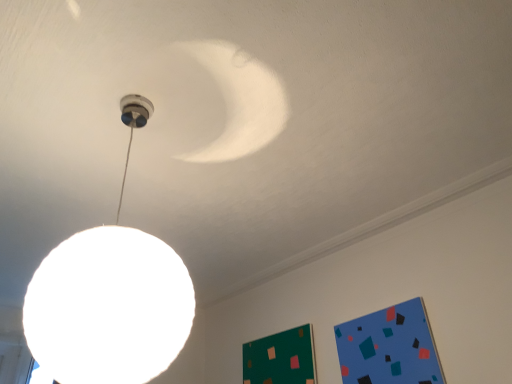
Question: From the image's perspective, would you say green matte bulletin board at lower right, positioned as the 1th bulletin board in left-to-right order, is shown under white matte globe lamp at upper center?

Choices:
 (A) yes
 (B) no

Answer: (A)

Question: Could you tell me if green matte bulletin board at lower right, the 2th bulletin board from the front, is facing white matte globe lamp at upper center?

Choices:
 (A) no
 (B) yes

Answer: (B)

Question: Considering the relative sizes of green matte bulletin board at lower right, positioned as the 1th bulletin board in left-to-right order, and white matte globe lamp at upper center in the image provided, is green matte bulletin board at lower right, positioned as the 1th bulletin board in left-to-right order, shorter than white matte globe lamp at upper center?

Choices:
 (A) yes
 (B) no

Answer: (A)

Question: Is green matte bulletin board at lower right, placed as the second bulletin board when sorted from right to left, further to the viewer compared to white matte globe lamp at upper center?

Choices:
 (A) no
 (B) yes

Answer: (B)

Question: Is the depth of green matte bulletin board at lower right, placed as the second bulletin board when sorted from right to left, less than that of white matte globe lamp at upper center?

Choices:
 (A) no
 (B) yes

Answer: (A)

Question: Can you confirm if green matte bulletin board at lower right, the 2th bulletin board from the front, is bigger than white matte globe lamp at upper center?

Choices:
 (A) no
 (B) yes

Answer: (A)

Question: Does blue matte bulletin board at lower right, placed as the first bulletin board when sorted from front to back, appear on the left side of green matte bulletin board at lower right, the 2th bulletin board from the front?

Choices:
 (A) no
 (B) yes

Answer: (A)

Question: Considering the relative sizes of blue matte bulletin board at lower right, placed as the first bulletin board when sorted from front to back, and green matte bulletin board at lower right, the 2th bulletin board from the front, in the image provided, is blue matte bulletin board at lower right, placed as the first bulletin board when sorted from front to back, shorter than green matte bulletin board at lower right, the 2th bulletin board from the front,?

Choices:
 (A) no
 (B) yes

Answer: (A)

Question: Considering the relative sizes of blue matte bulletin board at lower right, which is the 2th bulletin board from left to right, and green matte bulletin board at lower right, the 2th bulletin board from the front, in the image provided, is blue matte bulletin board at lower right, which is the 2th bulletin board from left to right, smaller than green matte bulletin board at lower right, the 2th bulletin board from the front,?

Choices:
 (A) no
 (B) yes

Answer: (A)

Question: Would you say green matte bulletin board at lower right, positioned as the 1th bulletin board in left-to-right order, is part of blue matte bulletin board at lower right, the 2th bulletin board in the back-to-front sequence,'s contents?

Choices:
 (A) yes
 (B) no

Answer: (B)

Question: Is blue matte bulletin board at lower right, the 2th bulletin board in the back-to-front sequence, oriented towards green matte bulletin board at lower right, placed as the second bulletin board when sorted from right to left?

Choices:
 (A) yes
 (B) no

Answer: (B)

Question: Is the depth of blue matte bulletin board at lower right, the 1th bulletin board positioned from the right, less than that of green matte bulletin board at lower right, positioned as the 1th bulletin board in left-to-right order?

Choices:
 (A) yes
 (B) no

Answer: (A)

Question: Considering the relative positions of white matte globe lamp at upper center and green matte bulletin board at lower right, the 2th bulletin board from the front, in the image provided, is white matte globe lamp at upper center in front of green matte bulletin board at lower right, the 2th bulletin board from the front,?

Choices:
 (A) yes
 (B) no

Answer: (A)